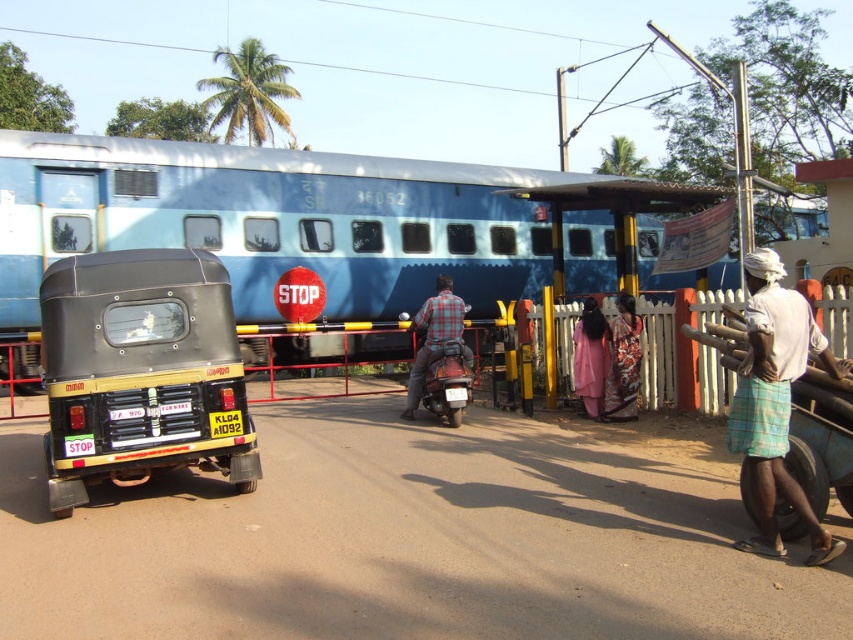
Question: Which point is closer to the camera?

Choices:
 (A) (53, 305)
 (B) (447, 282)

Answer: (A)

Question: Which point is farther to the camera?

Choices:
 (A) (618, 326)
 (B) (602, 356)
 (C) (407, 394)

Answer: (C)

Question: Can you confirm if matte black auto-rickshaw at lower left is smaller than white cotton shirt at right?

Choices:
 (A) yes
 (B) no

Answer: (B)

Question: Does matte black auto-rickshaw at lower left appear over pink fabric dress at center?

Choices:
 (A) yes
 (B) no

Answer: (B)

Question: Which of the following is the farthest from the observer?

Choices:
 (A) pink fabric dress at center
 (B) checkered fabric shirt at center
 (C) blue matte train at center
 (D) white cotton shirt at right

Answer: (C)

Question: Does blue matte train at center have a greater width compared to matte black auto-rickshaw at lower left?

Choices:
 (A) no
 (B) yes

Answer: (B)